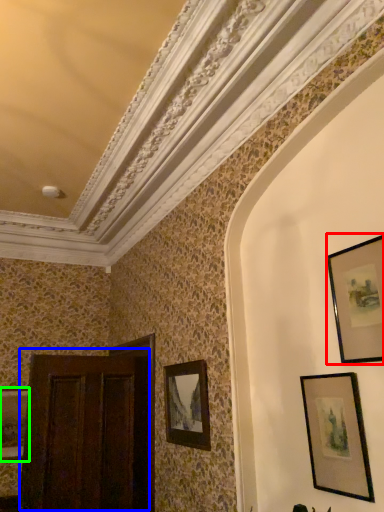
Question: Estimate the real-world distances between objects in this image. Which object is farther from picture frame (highlighted by a red box), door (highlighted by a blue box) or picture frame (highlighted by a green box)?

Choices:
 (A) door
 (B) picture frame

Answer: (B)